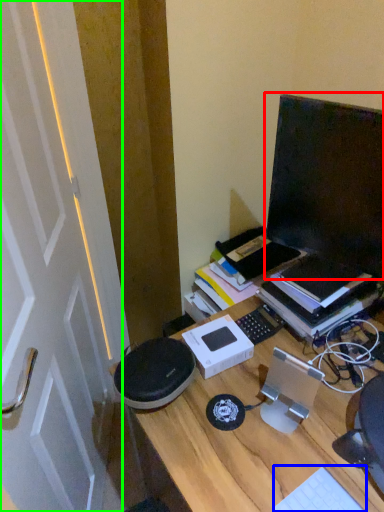
Question: Which is farther away from computer monitor (highlighted by a red box)? computer keyboard (highlighted by a blue box) or door (highlighted by a green box)?

Choices:
 (A) computer keyboard
 (B) door

Answer: (B)